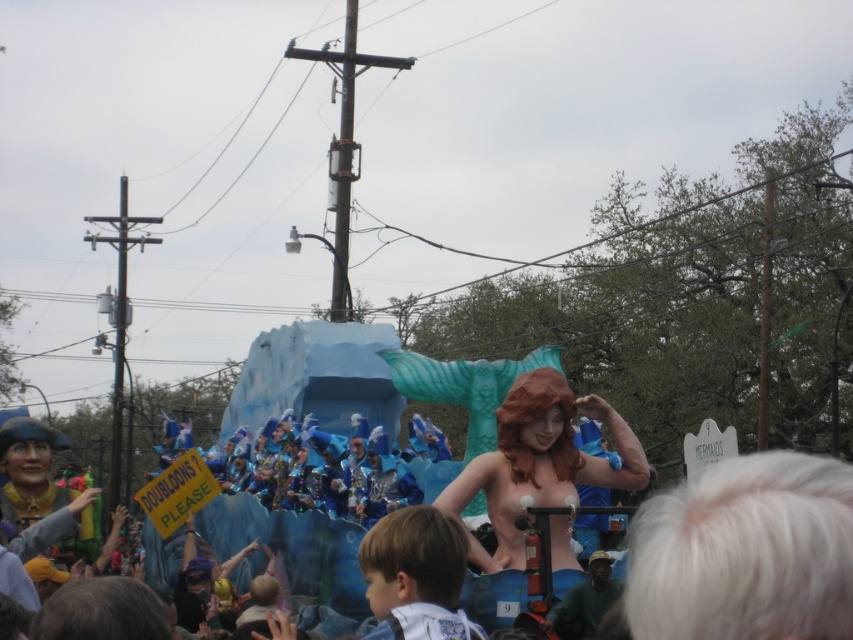
The height and width of the screenshot is (640, 853). I want to click on smooth blue tail at center, so click(x=532, y=477).

What do you see at coordinates (532, 477) in the screenshot? I see `smooth blue tail at center` at bounding box center [532, 477].

This screenshot has width=853, height=640. I want to click on smooth blue tail at center, so click(532, 477).